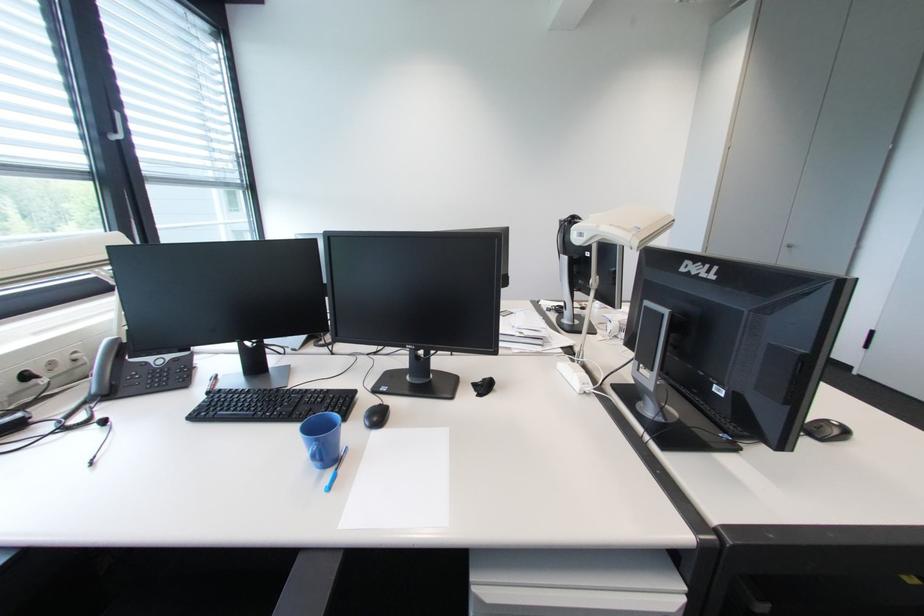
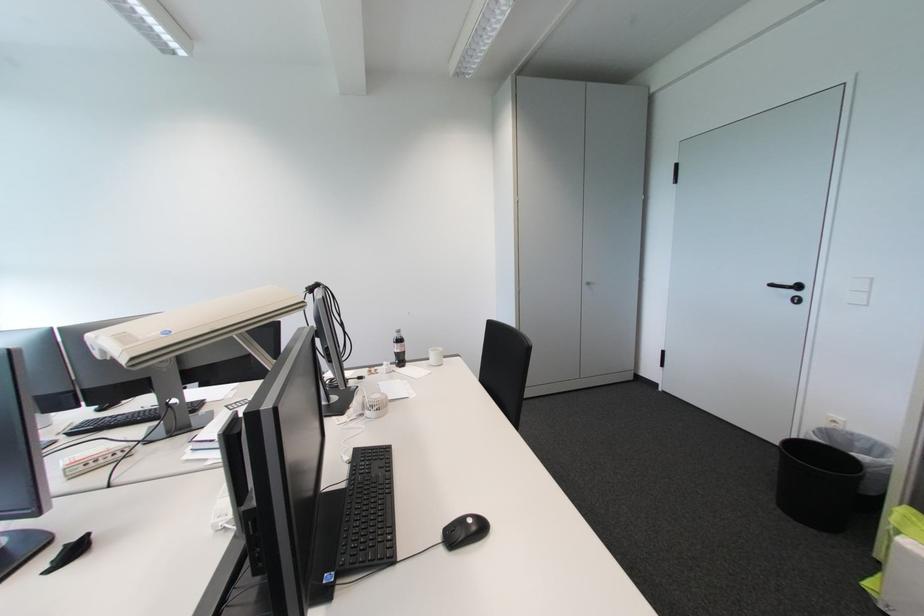
Question: How did the camera likely rotate?

Choices:
 (A) Left
 (B) Right
 (C) Up
 (D) Down

Answer: (B)